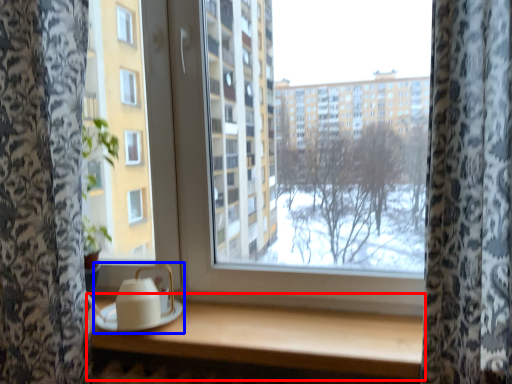
Question: Which object is closer to the camera taking this photo, table (highlighted by a red box) or tea set (highlighted by a blue box)?

Choices:
 (A) table
 (B) tea set

Answer: (A)